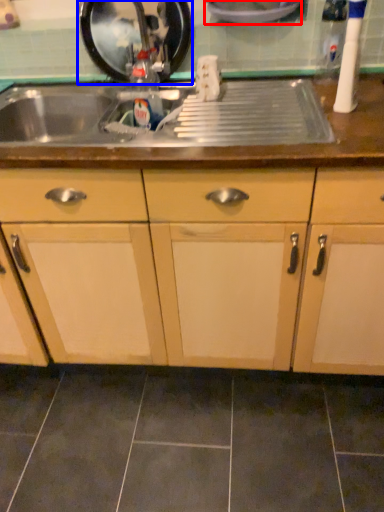
Question: Which object appears closest to the camera in this image, appliance (highlighted by a red box) or appliance (highlighted by a blue box)?

Choices:
 (A) appliance
 (B) appliance

Answer: (A)